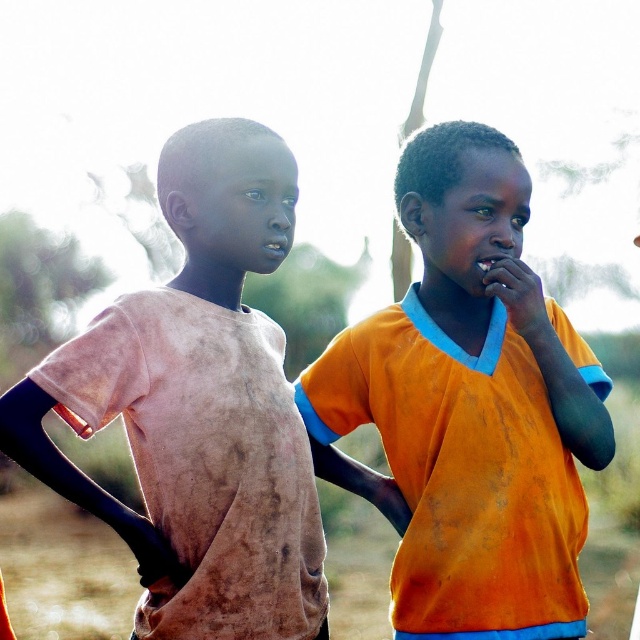
You are a photographer who wants to ensure both children are visible in the photo. Given the orange fabric shirt at center and the dirty pink shirt at left, which child should you focus on to make sure both are in focus?

The orange fabric shirt at center is bigger than the dirty pink shirt at left, so focusing on the orange fabric shirt at center will ensure both are in focus because it is larger and closer to the camera.

You are taking a photo of the scene described. The orange fabric shirt at center is at coordinates 0.637, 0.733. If you want to focus on this shirt, should you adjust the camera to focus closer or farther away than the current setting?

The orange fabric shirt at center is located at point (468, 406). Since the background is softly blurred, indicating a shallow depth of field, the current focus is likely already on the subject. Therefore, no adjustment is needed unless the shirt is not in focus. However, based on the description, the shirt is at the center, so it should already be in focus.

You are a photographer who wants to ensure both the orange fabric shirt at center and the dirty pink shirt at left are clearly visible in the photo. Based on the scene description, which shirt is closer to the camera?

The orange fabric shirt at center is closer to the camera because the dirty pink shirt at left is behind it.